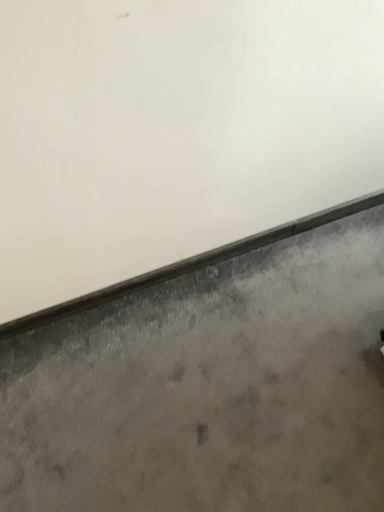
Question: From a real-world perspective, is gray concrete at bottom physically located above or below gray concrete window sill at lower center?

Choices:
 (A) below
 (B) above

Answer: (A)

Question: Considering their positions, is gray concrete at bottom located in front of or behind gray concrete window sill at lower center?

Choices:
 (A) front
 (B) behind

Answer: (A)

Question: Is point (278, 293) positioned closer to the camera than point (226, 245)?

Choices:
 (A) farther
 (B) closer

Answer: (B)

Question: Looking at their shapes, would you say gray concrete window sill at lower center is wider or thinner than gray concrete at bottom?

Choices:
 (A) wide
 (B) thin

Answer: (B)

Question: In the image, is gray concrete window sill at lower center on the left side or the right side of gray concrete at bottom?

Choices:
 (A) left
 (B) right

Answer: (A)

Question: In terms of height, does gray concrete window sill at lower center look taller or shorter compared to gray concrete at bottom?

Choices:
 (A) short
 (B) tall

Answer: (B)

Question: Is gray concrete window sill at lower center spatially inside gray concrete at bottom, or outside of it?

Choices:
 (A) inside
 (B) outside

Answer: (B)